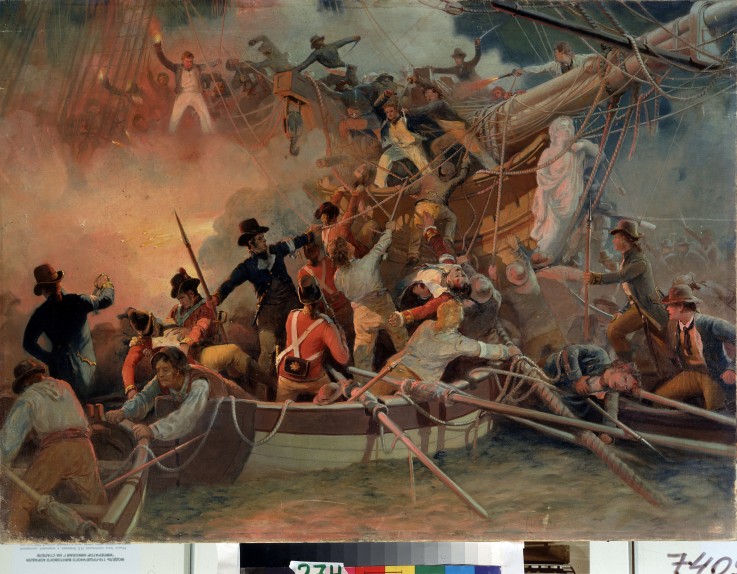
What are the coordinates of `painting` in the screenshot? It's located at (368, 318).